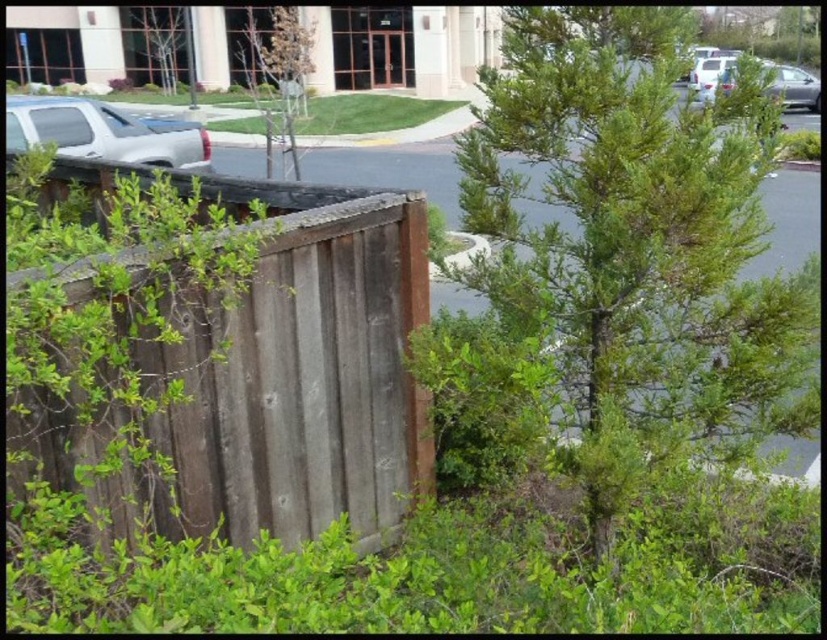
You are standing at point (149, 28) and want to walk to point (113, 131). Is the path between these two points clear of obstacles?

The path between point (113, 131) and point (149, 28) is clear because point (113, 131) is in front of point (149, 28), indicating no obstruction between them.

You are a delivery person trying to park your van in the parking lot. You see the weathered wood fence at left and the silver metallic truck at left. Which object is bigger and might block your path?

The weathered wood fence at left is larger in size than the silver metallic truck at left, so it might block your path more significantly.

You are a delivery driver who needs to park your truck in the parking lot. You see the silver metallic truck at left and the green leafy tree at upper left. Which object is closer to you?

The silver metallic truck at left is closer to you because it appears smaller than the green leafy tree at upper left, which is further away.